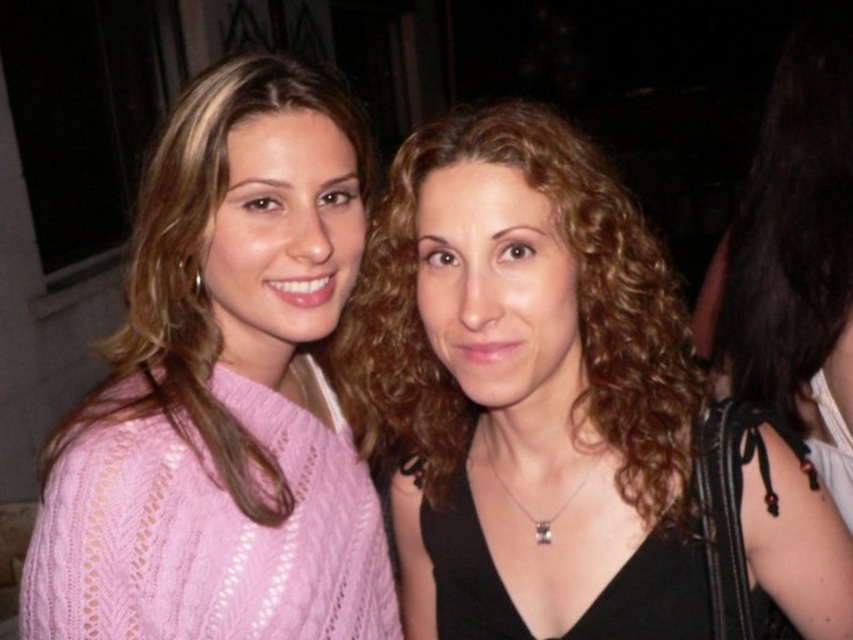
Is point (351, 346) positioned after point (61, 509)?

Yes, it is behind point (61, 509).

Is matte black top at center wider than pink knitted sweater at center?

Correct, the width of matte black top at center exceeds that of pink knitted sweater at center.

What do you see at coordinates (564, 412) in the screenshot? The height and width of the screenshot is (640, 853). I see `matte black top at center` at bounding box center [564, 412].

Where is `matte black top at center`? The height and width of the screenshot is (640, 853). matte black top at center is located at coordinates (564, 412).